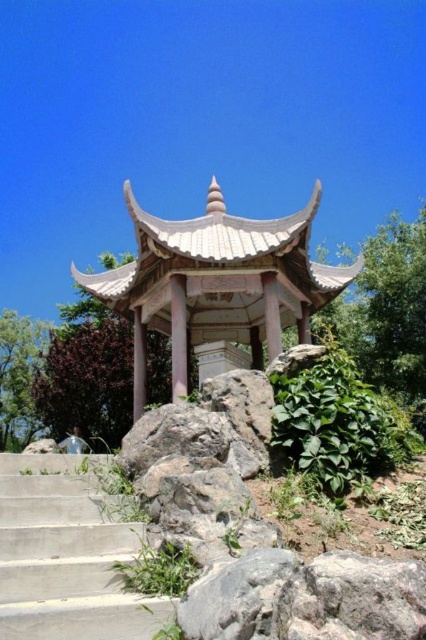
Question: Which of the following is the farthest from the observer?

Choices:
 (A) (36, 474)
 (B) (143, 250)

Answer: (B)

Question: Can you confirm if concrete stairs at lower left is smaller than green leafy plant at center right?

Choices:
 (A) no
 (B) yes

Answer: (B)

Question: Which of these objects is positioned farthest from the green leafy plant at center right?

Choices:
 (A) white stone gazebo at center
 (B) concrete stairs at lower left

Answer: (A)

Question: Does white stone gazebo at center appear over green leafy plant at center right?

Choices:
 (A) no
 (B) yes

Answer: (B)

Question: Considering the relative positions of concrete stairs at lower left and green leafy plant at center right in the image provided, where is concrete stairs at lower left located with respect to green leafy plant at center right?

Choices:
 (A) below
 (B) above

Answer: (A)

Question: Which point is farther to the camera?

Choices:
 (A) (278, 320)
 (B) (57, 513)

Answer: (A)